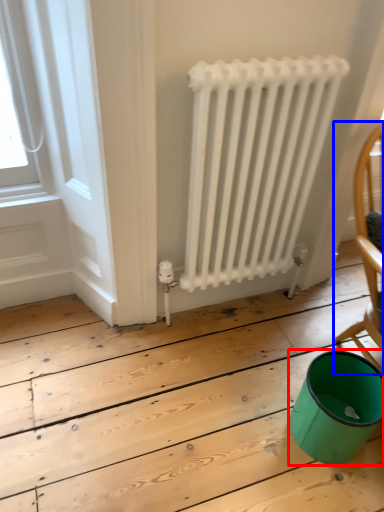
Question: Which of the following is the farthest to the observer, teal (highlighted by a red box) or chair (highlighted by a blue box)?

Choices:
 (A) teal
 (B) chair

Answer: (B)